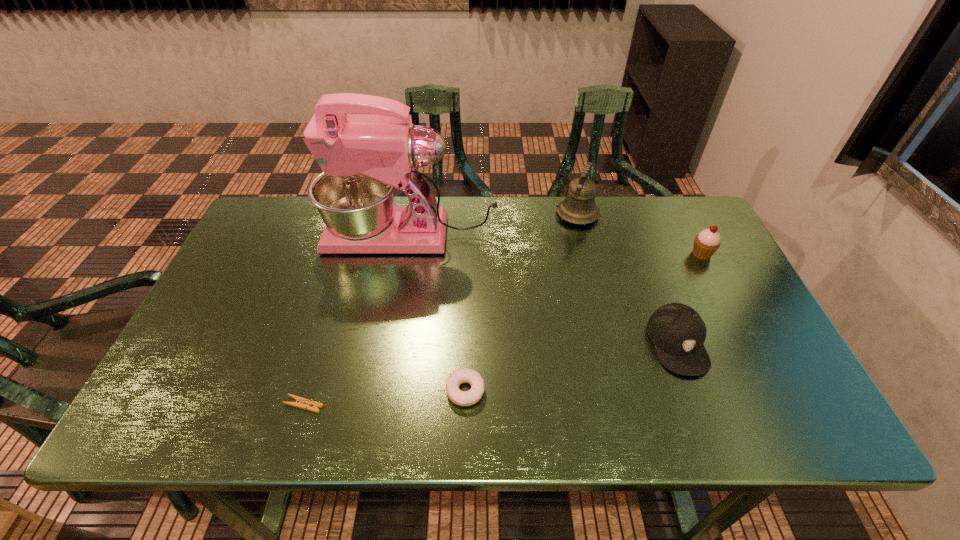
The width and height of the screenshot is (960, 540). What are the coordinates of `clothespin that is at the near edge` in the screenshot? It's located at (302, 403).

The height and width of the screenshot is (540, 960). What are the coordinates of `object situated at the right edge` in the screenshot? It's located at (706, 243).

I want to click on free point at the far edge, so click(454, 229).

Where is `vacant space at the near edge`? vacant space at the near edge is located at coordinates (434, 423).

Where is `free region at the left edge of the desktop`? free region at the left edge of the desktop is located at coordinates (264, 301).

Find the location of `vacant space at the right edge`. vacant space at the right edge is located at coordinates (731, 277).

Locate an element on the screen. blank area at the far left corner is located at coordinates (257, 226).

Where is `vacant space at the far right corner of the desktop`? This screenshot has width=960, height=540. vacant space at the far right corner of the desktop is located at coordinates (683, 215).

This screenshot has width=960, height=540. Identify the location of free space between the clothespin and the mixer. (358, 320).

The width and height of the screenshot is (960, 540). In order to click on free spot between the fourth tallest object and the shortest object in this screenshot , I will do `click(491, 374)`.